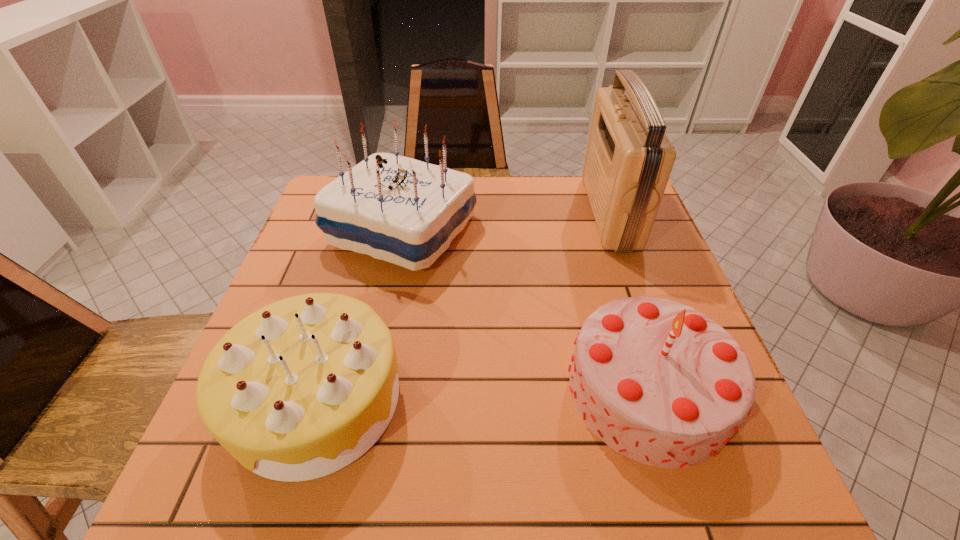
Find the location of a particular element. This screenshot has width=960, height=540. vacant space situated on the left of the rightmost birthday cake is located at coordinates (352, 390).

Find the location of a particular element. The height and width of the screenshot is (540, 960). free space located 0.210m on the back of the shortest object is located at coordinates (357, 264).

Identify the location of radio receiver located in the far edge section of the desktop. (628, 161).

Where is `birthday cake that is at the far edge`? This screenshot has width=960, height=540. birthday cake that is at the far edge is located at coordinates (398, 209).

The width and height of the screenshot is (960, 540). I want to click on radio receiver positioned at the right edge, so click(x=628, y=161).

The height and width of the screenshot is (540, 960). What are the coordinates of `birthday cake present at the right edge` in the screenshot? It's located at (659, 382).

Locate an element on the screen. This screenshot has height=540, width=960. object present at the far left corner is located at coordinates (398, 209).

The image size is (960, 540). I want to click on object that is at the near left corner, so (x=299, y=389).

Find the location of a particular element. This screenshot has height=540, width=960. object present at the far right corner is located at coordinates (628, 161).

Locate an element on the screen. This screenshot has height=540, width=960. object that is at the near right corner is located at coordinates (659, 382).